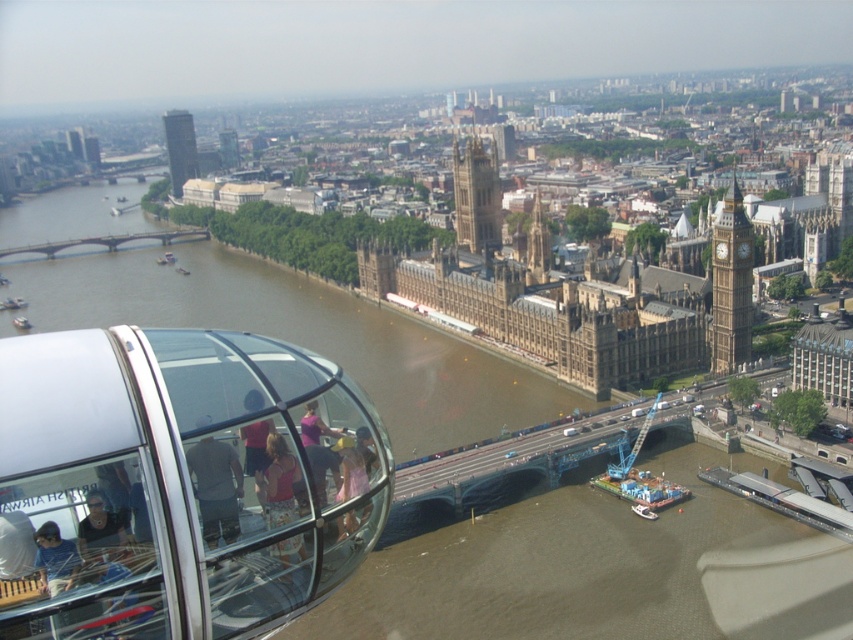
Question: Is brown water at center to the right of pink fabric at center from the viewer's perspective?

Choices:
 (A) yes
 (B) no

Answer: (B)

Question: Does golden stone clock tower at upper center appear over light brown fabric shirt at center?

Choices:
 (A) no
 (B) yes

Answer: (B)

Question: Which point is farther from the camera taking this photo?

Choices:
 (A) (149, 237)
 (B) (288, 458)

Answer: (A)

Question: Which point is closer to the camera taking this photo?

Choices:
 (A) (263, 275)
 (B) (283, 481)

Answer: (B)

Question: Which point is farther to the camera?

Choices:
 (A) (216, 513)
 (B) (329, 449)
 (C) (732, 369)

Answer: (C)

Question: Can you confirm if light brown fabric shirt at center is positioned below brown wooden bridge at left?

Choices:
 (A) yes
 (B) no

Answer: (A)